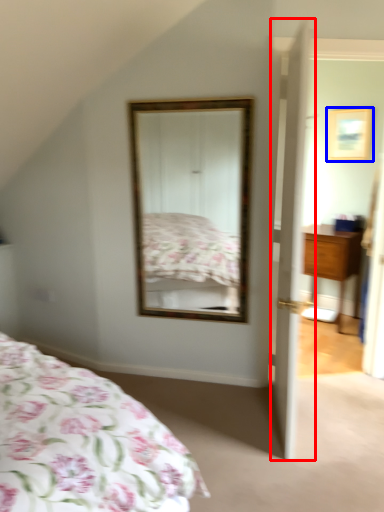
Question: Which of the following is the farthest to the observer, door (highlighted by a red box) or picture frame (highlighted by a blue box)?

Choices:
 (A) door
 (B) picture frame

Answer: (B)